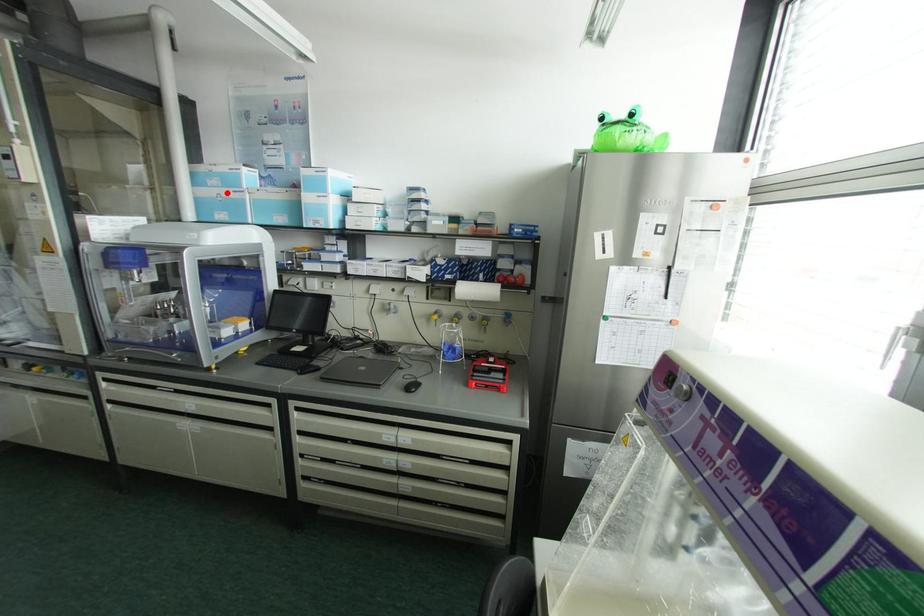
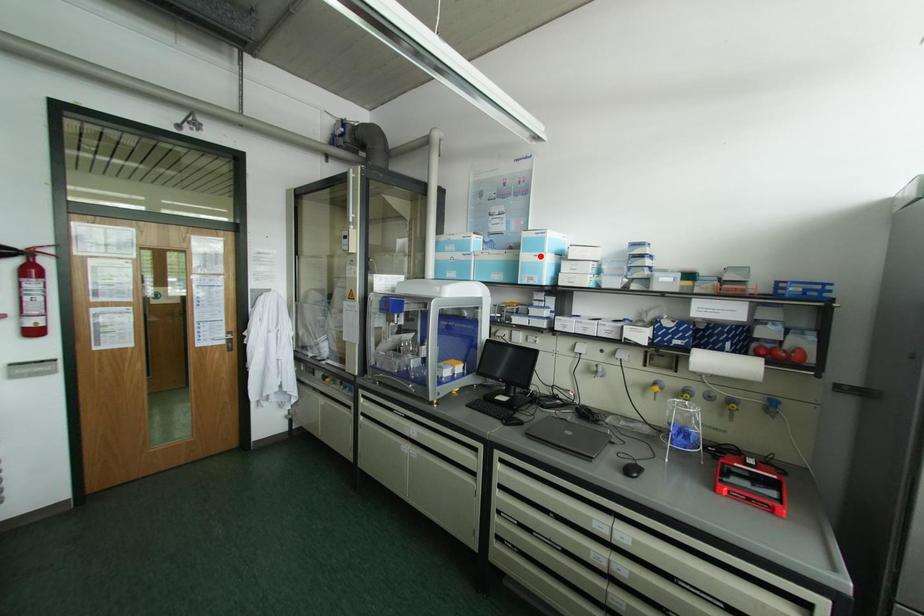
I am providing you with two images of the same scene from different viewpoints. A red point is marked on the first image and another point is marked on the second image. Do the highlighted points in image1 and image2 indicate the same real-world spot?

No